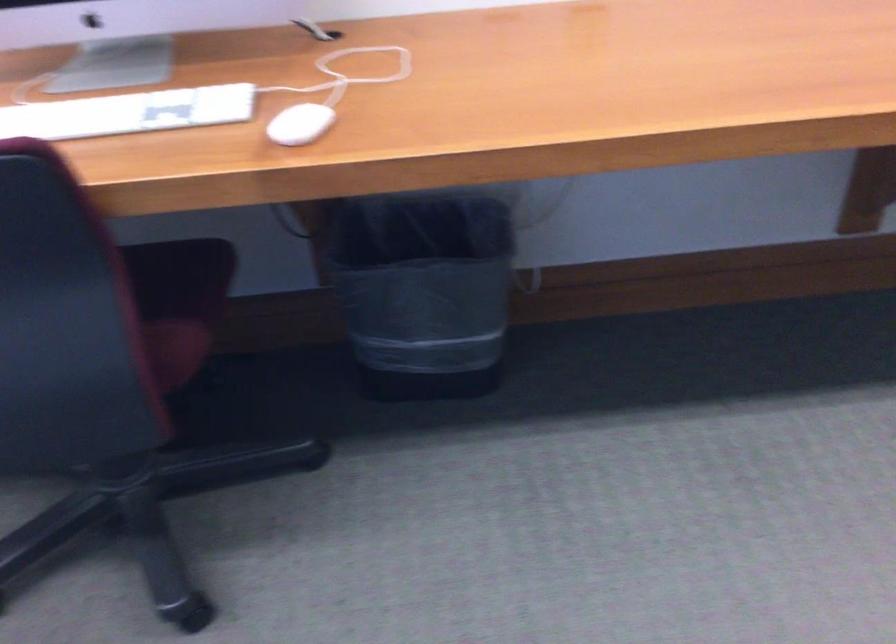
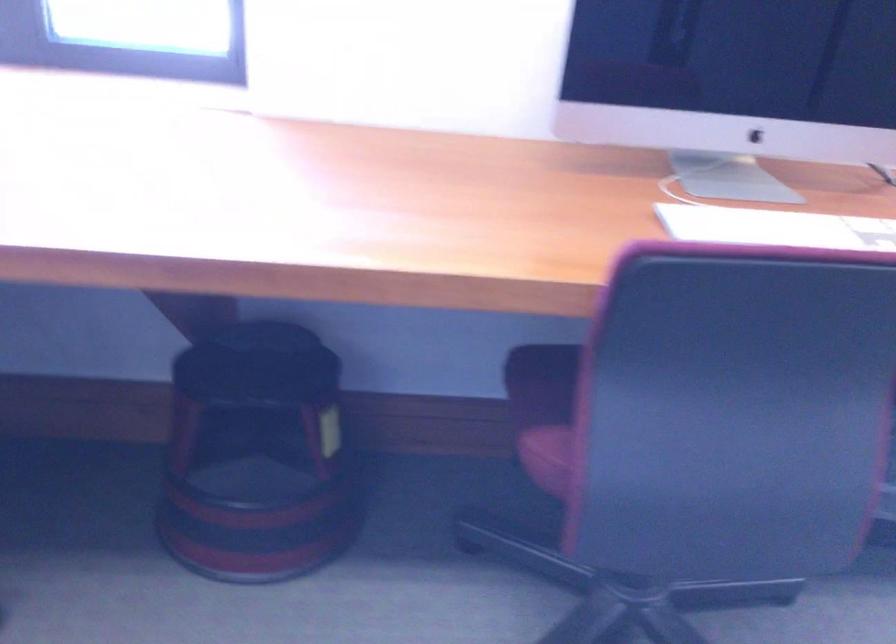
Question: The images are taken continuously from a first-person perspective. In which direction is your viewpoint rotating?

Choices:
 (A) Left
 (B) Right
 (C) Up
 (D) Down

Answer: (C)